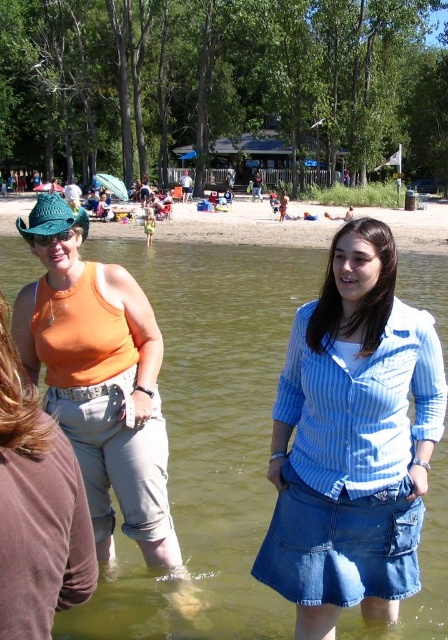
You are a photographer at the lakeside scene. You need to capture a photo that includes both the blue striped shirt at center and the orange matte tank top at upper left. Based on their positions, which one should be placed on the left side of the photo to ensure both are visible?

The orange matte tank top at upper left should be placed on the left side of the photo since the blue striped shirt at center is positioned to its right, making the orange matte tank top naturally appear on the left in the frame.

You are a photographer trying to capture the entire scene of the greenish water at center and orange matte tank top at left in one shot. Given that your camera has a fixed focal length, which object should you focus on to ensure both are in frame?

To capture both the greenish water at center and orange matte tank top at left in one shot, focus on the orange matte tank top at left since it is smaller and closer to the camera, allowing the larger greenish water at center to also fit within the frame.